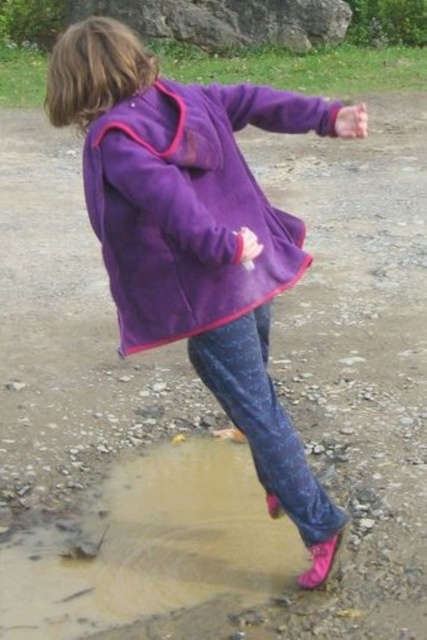
Question: Does purple fleece jacket at center have a smaller size compared to smooth gray rock at upper center?

Choices:
 (A) no
 (B) yes

Answer: (B)

Question: Does purple fleece jacket at center have a smaller size compared to smooth gray rock at upper center?

Choices:
 (A) yes
 (B) no

Answer: (A)

Question: In this image, where is purple fleece jacket at center located relative to smooth gray rock at upper center?

Choices:
 (A) right
 (B) left

Answer: (A)

Question: Which object is farther from the camera taking this photo?

Choices:
 (A) purple fleece jacket at center
 (B) smooth gray rock at upper center

Answer: (B)